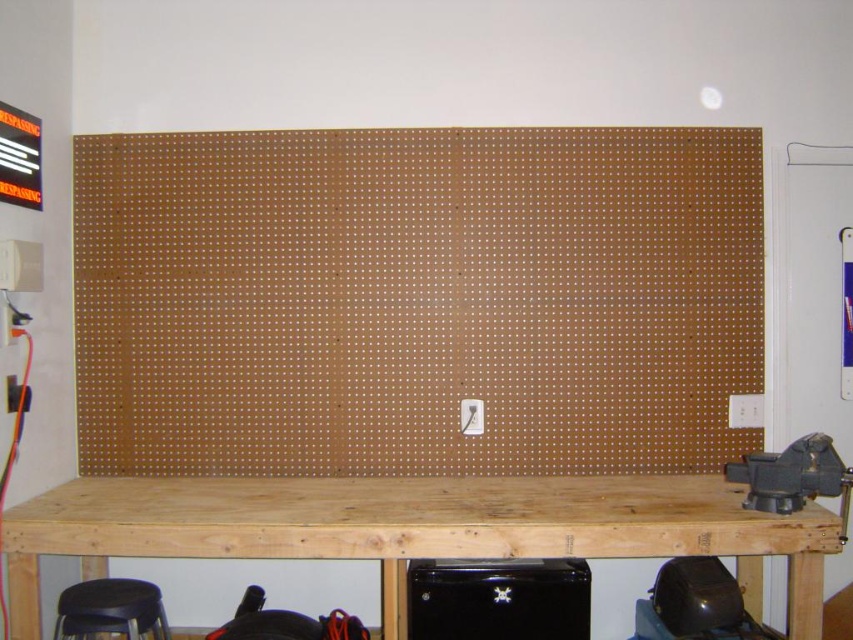
Question: Can you confirm if brown pegboard at center is positioned to the left of black matte stool at lower left?

Choices:
 (A) no
 (B) yes

Answer: (A)

Question: Estimate the real-world distances between objects in this image. Which object is closer to the natural wood table at center?

Choices:
 (A) brown pegboard at center
 (B) black matte stool at lower left

Answer: (B)

Question: Considering the real-world distances, which object is closest to the black matte stool at lower left?

Choices:
 (A) brown pegboard at center
 (B) natural wood table at center

Answer: (B)

Question: Can you confirm if natural wood table at center is positioned to the left of black matte stool at lower left?

Choices:
 (A) no
 (B) yes

Answer: (A)

Question: Which point appears closest to the camera in this image?

Choices:
 (A) (625, 515)
 (B) (148, 592)
 (C) (746, 321)

Answer: (A)

Question: Does natural wood table at center have a lesser width compared to black matte stool at lower left?

Choices:
 (A) no
 (B) yes

Answer: (A)